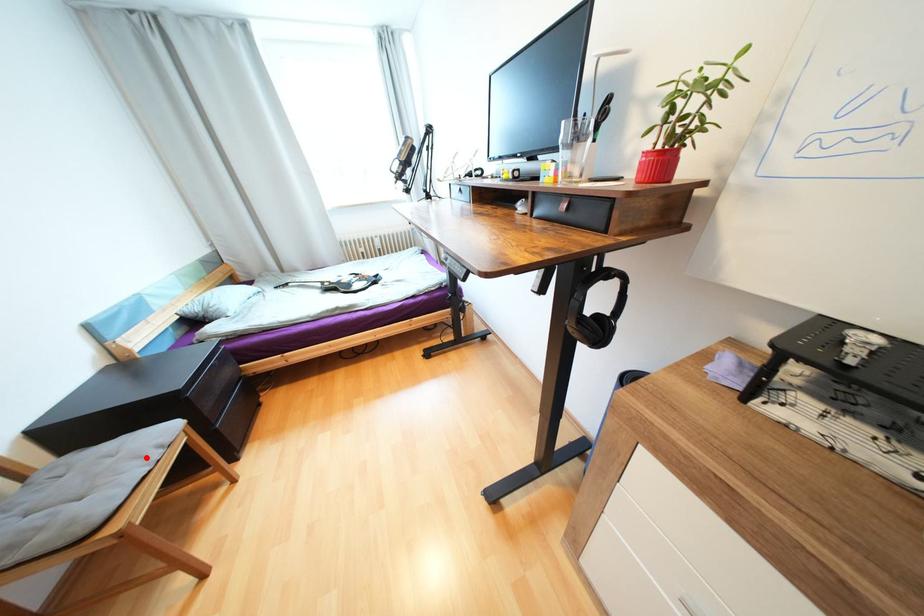
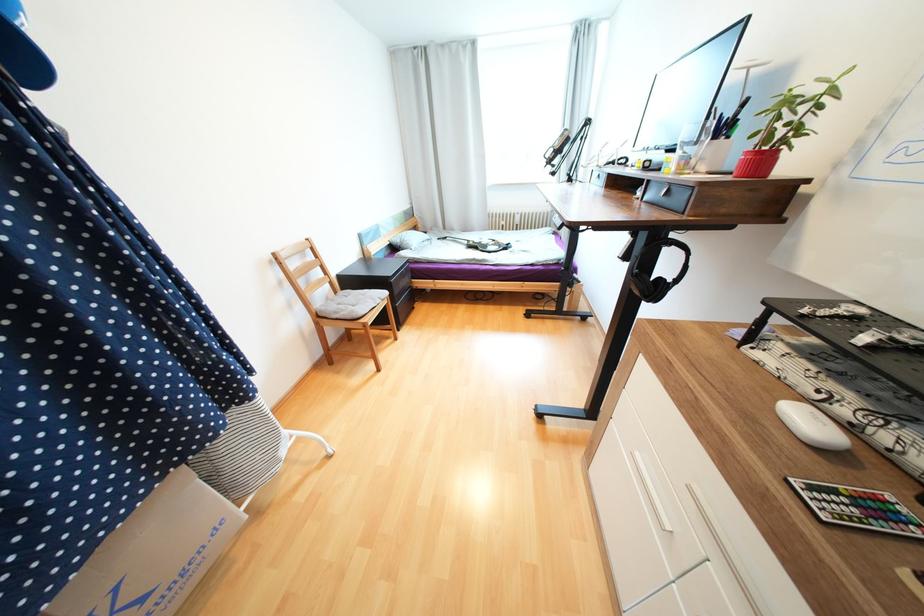
In the second image, find the point that corresponds to the highlighted location in the first image.

(379, 300)